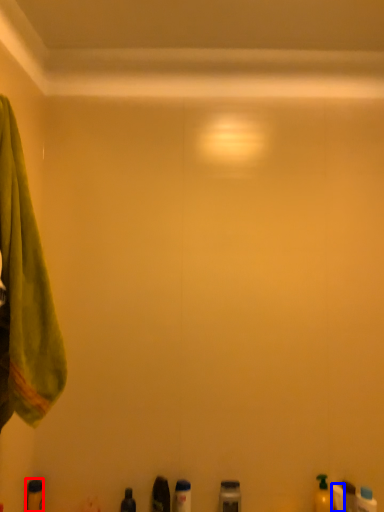
Question: Which of the following is the closest to the observer, toiletry (highlighted by a red box) or toiletry (highlighted by a blue box)?

Choices:
 (A) toiletry
 (B) toiletry

Answer: (B)